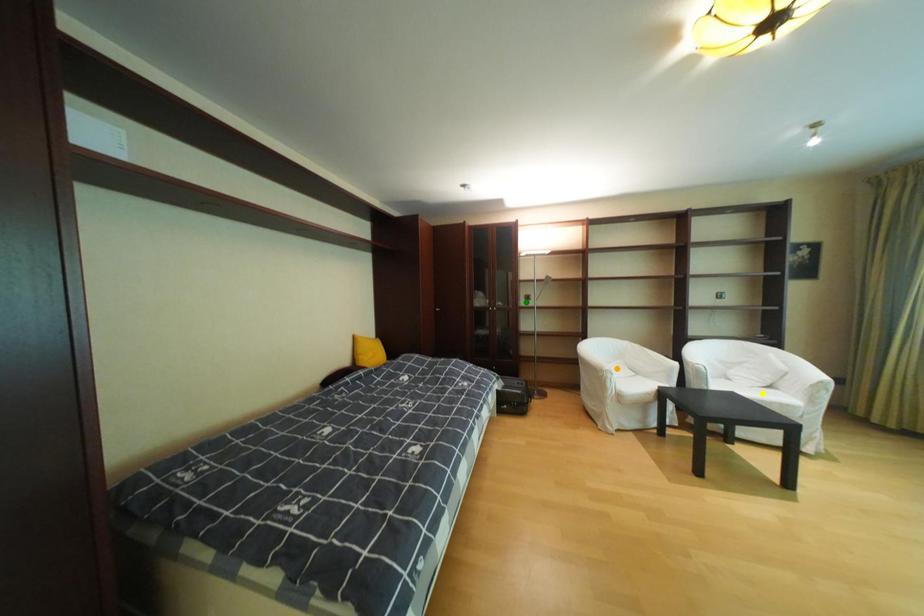
Order these from nearest to farthest:
orange point
yellow point
green point

green point → orange point → yellow point